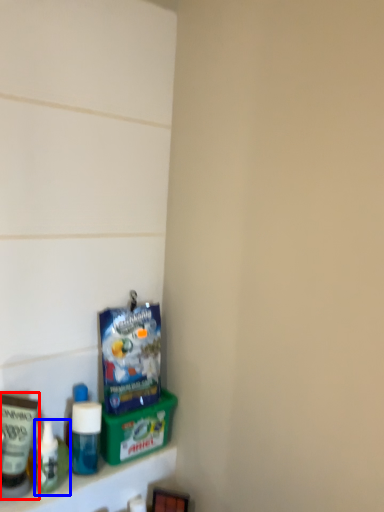
Question: Which of the following is the closest to the observer, toiletry (highlighted by a red box) or toiletry (highlighted by a blue box)?

Choices:
 (A) toiletry
 (B) toiletry

Answer: (A)